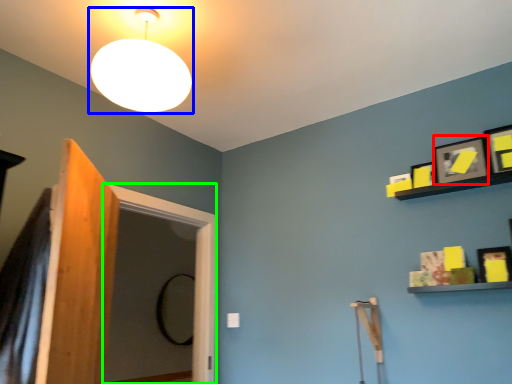
Question: Estimate the real-world distances between objects in this image. Which object is closer to picture frame (highlighted by a red box), lamp (highlighted by a blue box) or screen door (highlighted by a green box)?

Choices:
 (A) lamp
 (B) screen door

Answer: (A)